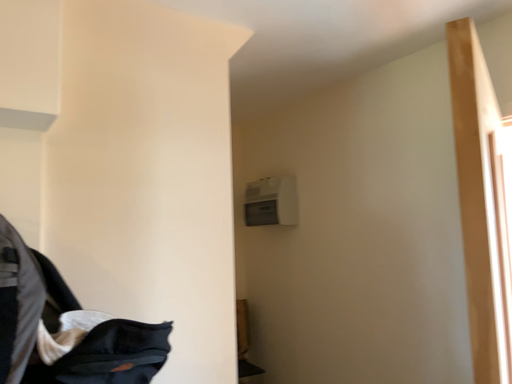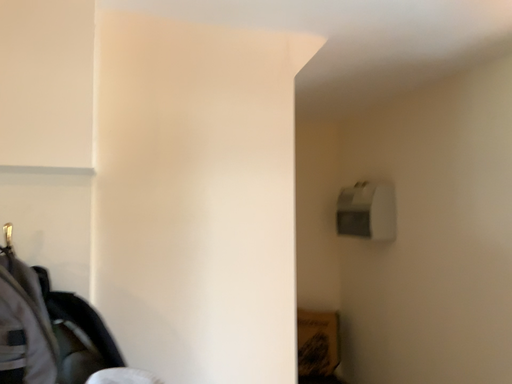
Question: Which way did the camera rotate in the video?

Choices:
 (A) rotated left
 (B) rotated right

Answer: (A)